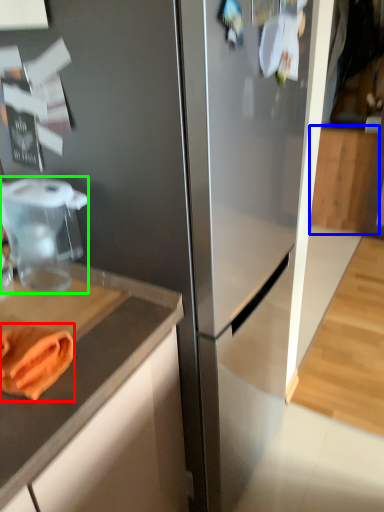
Question: Considering the real-world distances, which object is closest to food (highlighted by a red box)? cabinetry (highlighted by a blue box) or food processor (highlighted by a green box).

Choices:
 (A) cabinetry
 (B) food processor

Answer: (B)